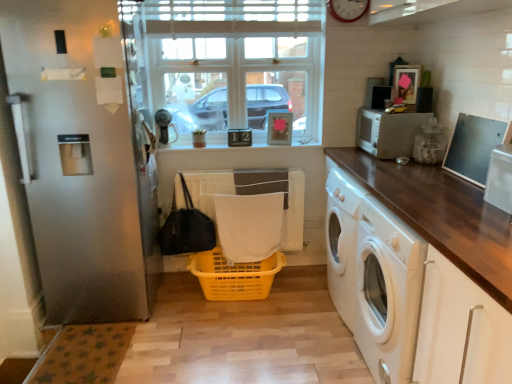
I want to click on yellow plastic basket at center, so click(234, 276).

What do you see at coordinates (348, 9) in the screenshot?
I see `wooden clock at upper center` at bounding box center [348, 9].

The width and height of the screenshot is (512, 384). I want to click on white matte microwave at upper right, so click(388, 132).

The width and height of the screenshot is (512, 384). Describe the element at coordinates (500, 178) in the screenshot. I see `metallic silver microwave at right` at that location.

You are a GUI agent. You are given a task and a screenshot of the screen. Output one action in this format:
    pyautogui.click(x=<x>, y=<y>)
    Task: Click on the yellow plastic basket at center
    This screenshot has height=384, width=512.
    Given the screenshot: What is the action you would take?
    pyautogui.click(x=234, y=276)

Is dark wood countertop at right aimed at satin silver screen door at left?

No.

Is dark wood countertop at right in front of satin silver screen door at left?

Yes.

Is point (442, 334) closer or farther from the camera than point (90, 9)?

Point (442, 334).

The width and height of the screenshot is (512, 384). In order to click on screen door above the dark wood countertop at right (from the image's perspective) in this screenshot , I will do `click(77, 176)`.

Is point (488, 177) less distant than point (96, 303)?

Yes.

Identify the location of appliance on the right of satin silver screen door at left. The height and width of the screenshot is (384, 512). (500, 178).

Which is in front, metallic silver microwave at right or satin silver screen door at left?

metallic silver microwave at right.

In the scene shown: Is metallic silver microwave at right to the left or to the right of satin silver screen door at left in the image?

Based on their positions, metallic silver microwave at right is located to the right of satin silver screen door at left.

Consider the image. From a real-world perspective, is white glass window at center physically above wooden clock at upper center?

No.

Considering the relative sizes of white glass window at center and wooden clock at upper center in the image provided, is white glass window at center smaller than wooden clock at upper center?

Incorrect, white glass window at center is not smaller in size than wooden clock at upper center.

Is white glass window at center positioned with its back to wooden clock at upper center?

That's not correct — white glass window at center is not looking away from wooden clock at upper center.

Can you confirm if white glass window at center is taller than wooden clock at upper center?

Indeed, white glass window at center has a greater height compared to wooden clock at upper center.

How many degrees apart are the facing directions of white glass window at center and white fabric at center?

white glass window at center and white fabric at center are facing 1.18 degrees away from each other.

Between white glass window at center and white fabric at center, which one has smaller width?

Thinner between the two is white fabric at center.

Is there a large distance between white glass window at center and white fabric at center?

No, white glass window at center is not far from white fabric at center.

Is white glass window at center not within white fabric at center?

Indeed, white glass window at center is completely outside white fabric at center.

Between white fabric at center and yellow plastic basket at center, which one appears on the right side from the viewer's perspective?

Positioned to the right is white fabric at center.

Looking at the image, does white fabric at center seem bigger or smaller compared to yellow plastic basket at center?

Clearly, white fabric at center is smaller in size than yellow plastic basket at center.

Looking at this image, from the image's perspective, which one is positioned lower, white fabric at center or yellow plastic basket at center?

yellow plastic basket at center is shown below in the image.

Is white fabric at center inside the boundaries of yellow plastic basket at center, or outside?

The correct answer is: outside.

From the image's perspective, which is above, dark wood countertop at right or metallic silver microwave at right?

From the image's view, metallic silver microwave at right is above.

From a real-world perspective, is dark wood countertop at right located beneath metallic silver microwave at right?

Correct, in the physical world, dark wood countertop at right is lower than metallic silver microwave at right.

Considering the sizes of objects dark wood countertop at right and metallic silver microwave at right in the image provided, who is smaller, dark wood countertop at right or metallic silver microwave at right?

metallic silver microwave at right is smaller.

How distant is satin silver screen door at left from metallic silver microwave at right?

satin silver screen door at left and metallic silver microwave at right are 1.95 meters apart.

Would you say satin silver screen door at left is inside or outside metallic silver microwave at right?

satin silver screen door at left is located beyond the bounds of metallic silver microwave at right.

How many degrees apart are the facing directions of satin silver screen door at left and metallic silver microwave at right?

The angular difference between satin silver screen door at left and metallic silver microwave at right is 180 degrees.

In terms of size, does satin silver screen door at left appear bigger or smaller than metallic silver microwave at right?

In the image, satin silver screen door at left appears to be larger than metallic silver microwave at right.

There is a dark wood countertop at right. Where is `screen door above it (from a real-world perspective)`? This screenshot has height=384, width=512. screen door above it (from a real-world perspective) is located at coordinates (77, 176).

In order to click on screen door above the metallic silver microwave at right (from the image's perspective) in this screenshot , I will do `click(77, 176)`.

Based on their spatial positions, is satin silver screen door at left or yellow plastic basket at center closer to white glass window at center?

Among the two, satin silver screen door at left is located nearer to white glass window at center.

Which object lies further to the anchor point satin silver screen door at left, metallic silver microwave at right or white fabric at center?

metallic silver microwave at right is further to satin silver screen door at left.

Which object lies nearer to the anchor point white matte microwave at upper right, metallic silver microwave at right or yellow plastic basket at center?

The object closer to white matte microwave at upper right is metallic silver microwave at right.

Considering their positions, is yellow plastic basket at center positioned further to white fabric at center than satin silver screen door at left?

The object further to white fabric at center is satin silver screen door at left.

Which object lies further to the anchor point dark wood countertop at right, white glass window at center or white fabric at center?

Based on the image, white glass window at center appears to be further to dark wood countertop at right.

When comparing their distances from white matte microwave at upper right, does metallic silver microwave at right or wooden clock at upper center seem closer?

Among the two, wooden clock at upper center is located nearer to white matte microwave at upper right.

Estimate the real-world distances between objects in this image. Which object is closer to white glass window at center, white matte microwave at upper right or metallic silver microwave at right?

white matte microwave at upper right lies closer to white glass window at center than the other object.

When comparing their distances from yellow plastic basket at center, does white fabric at center or white glass window at center seem further?

white glass window at center is positioned further to the anchor yellow plastic basket at center.

This screenshot has height=384, width=512. I want to click on countertop between yellow plastic basket at center and metallic silver microwave at right, so click(450, 236).

Where is `material between wooden clock at upper center and yellow plastic basket at center in the up-down direction`? Image resolution: width=512 pixels, height=384 pixels. material between wooden clock at upper center and yellow plastic basket at center in the up-down direction is located at coordinates (249, 225).

Locate an element on the screen. home appliance positioned between dark wood countertop at right and yellow plastic basket at center from near to far is located at coordinates (388, 132).

Locate an element on the screen. Image resolution: width=512 pixels, height=384 pixels. basket positioned between dark wood countertop at right and white fabric at center from near to far is located at coordinates (234, 276).